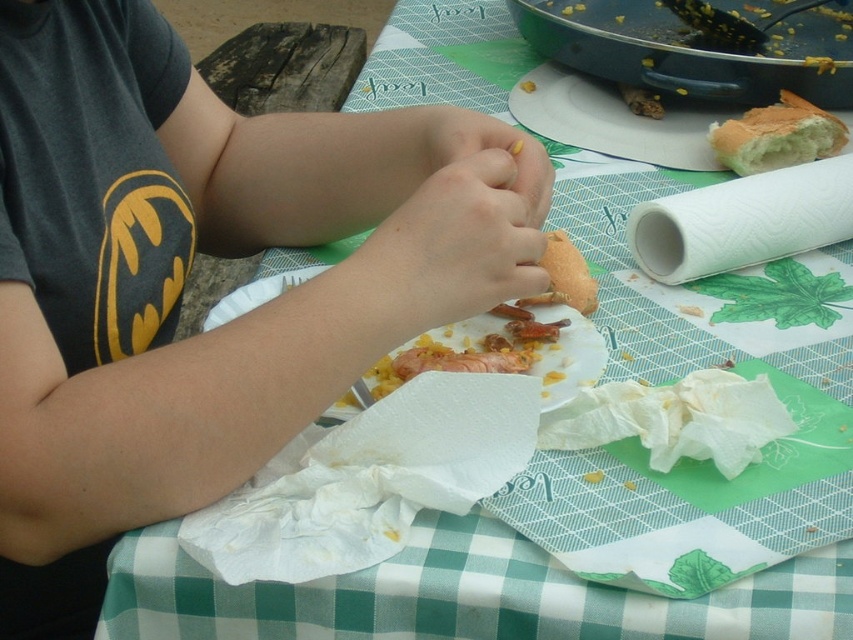
You are setting up a picnic and need to place the white paper plate at upper right and the bread at upper right on the table. Since you want the taller item to be closer to you, which object should you place nearer?

The white paper plate at upper right is taller than the bread at upper right, so you should place the white paper plate at upper right closer to you.

You are a photographer trying to capture a close shot of the white paper plate at center without including the matte black shirt at upper left in the frame. Based on their positions, do you think this is possible?

The matte black shirt at upper left might be wider than the white paper plate at center, so there is a possibility that the shirt could still be visible in the frame if they are positioned in a way that the shirt extends beyond the plate. To ensure the shirt isn

You are a person who wants to clean up the table. You need to pick up the white paper plate at upper right and the bread at upper right. Which one should you pick up first to avoid knocking over the other?

You should pick up the white paper plate at upper right first because it is closer to you than the bread at upper right, so picking it up first will prevent it from accidentally knocking over the bread behind it.